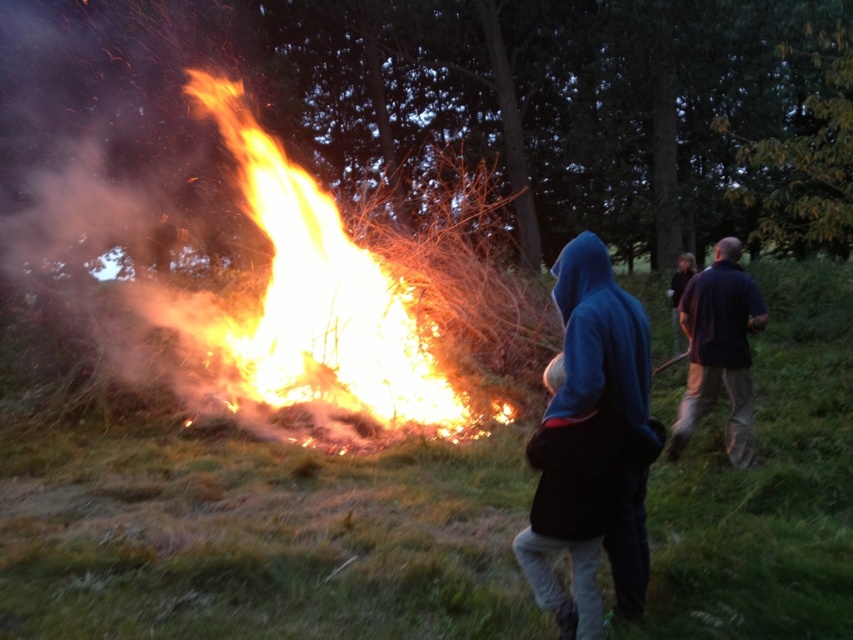
Consider the image. You are a photographer trying to capture both the blue fleece jacket at center and the dark blue shirt at right in a single frame. Which clothing item should you focus on to ensure both are in focus, considering their sizes and positions?

The blue fleece jacket at center is smaller than the dark blue shirt at right, so focusing on the dark blue shirt at right would help ensure both are in focus as it is larger and further away.

You are a photographer trying to capture both the blue fleece jacket at center and the dark blue shirt at right in a single shot. Based on their positions, which one should you focus on first to ensure both are in focus?

The blue fleece jacket at center is closer to the viewer than the dark blue shirt at right. To ensure both are in focus, you should focus on the blue fleece jacket at center first.